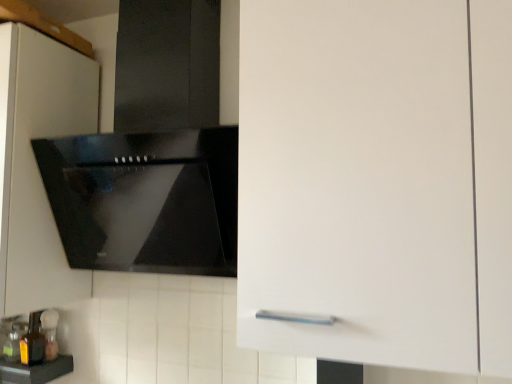
Question: From a real-world perspective, is black glossy countertop at lower left positioned above or below translucent amber bottle at lower left, positioned as the second bottle in back-to-front order?

Choices:
 (A) above
 (B) below

Answer: (B)

Question: From their relative heights in the image, would you say black glossy countertop at lower left is taller or shorter than translucent amber bottle at lower left, which appears as the 1th bottle when viewed from the front?

Choices:
 (A) short
 (B) tall

Answer: (A)

Question: Which is nearer to the black glossy countertop at lower left?

Choices:
 (A) translucent glass bottle at lower left, which ranks as the 1th bottle in back-to-front order
 (B) translucent amber bottle at lower left, positioned as the second bottle in back-to-front order
 (C) white matte cabinet at upper left

Answer: (B)

Question: Considering the real-world distances, which object is closest to the white matte cabinet at upper left?

Choices:
 (A) translucent glass bottle at lower left, which ranks as the 1th bottle in back-to-front order
 (B) black glossy countertop at lower left
 (C) translucent amber bottle at lower left, positioned as the second bottle in back-to-front order

Answer: (C)